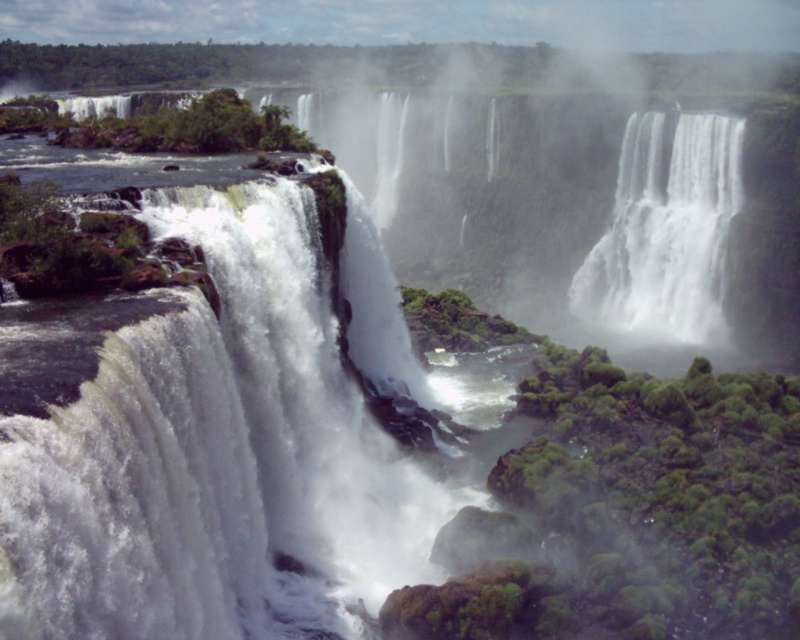
You are standing at the point labeled point (238, 291) in the image. The nearest waterfall is 70.61 feet away from you. Is there enough space to safely walk towards the nearest waterfall without getting too close?

The nearest waterfall is 70.61 feet away from the point labeled point (238, 291). Since this distance is sufficient for safe walking, you can move towards the waterfall without getting too close.